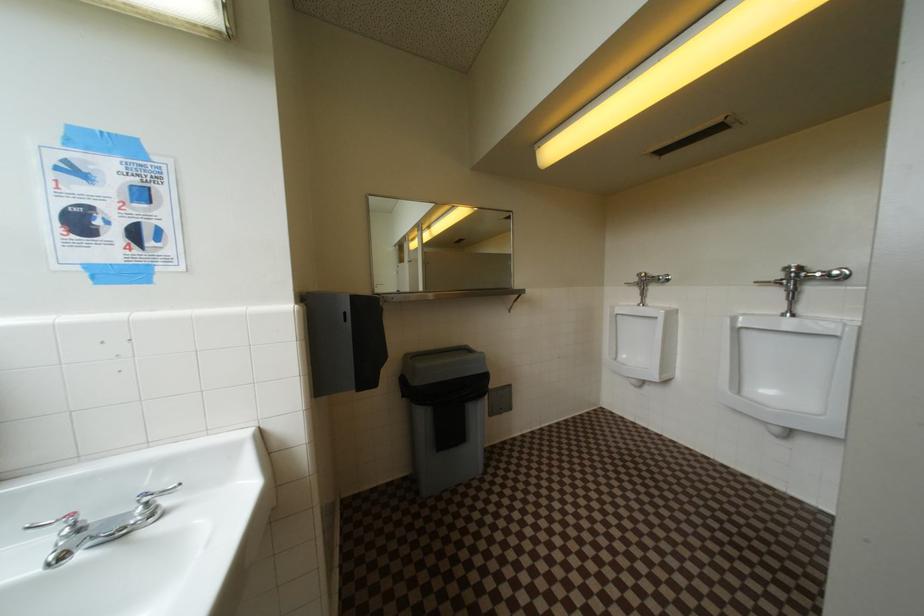
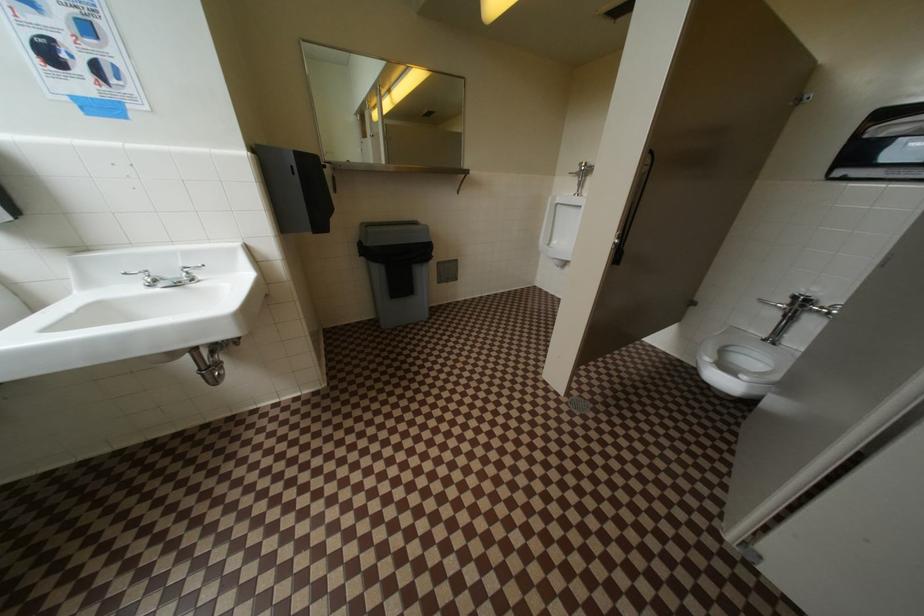
Question: Based on the continuous images, in which direction is the camera rotating? Reply with the corresponding letter.

Choices:
 (A) Left
 (B) Right
 (C) Up
 (D) Down

Answer: (D)